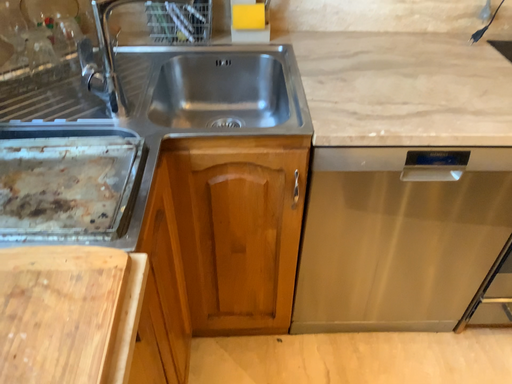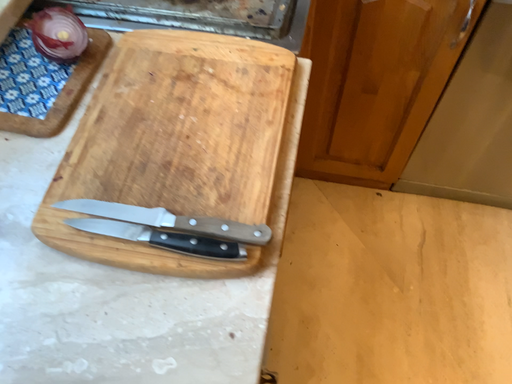
Question: Which way did the camera rotate in the video?

Choices:
 (A) rotated upward
 (B) rotated downward

Answer: (B)